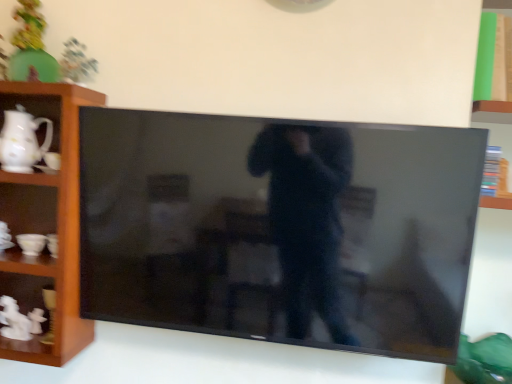
What do you see at coordinates (31, 47) in the screenshot? The width and height of the screenshot is (512, 384). I see `matte green toy at upper left` at bounding box center [31, 47].

What is the approximate width of black glossy tv at center?

black glossy tv at center is 6.54 inches in width.

This screenshot has height=384, width=512. Describe the element at coordinates (29, 179) in the screenshot. I see `white glossy pitcher at left` at that location.

This screenshot has height=384, width=512. I want to click on matte green toy at upper left, so (31, 47).

Which object is closer to the camera, white glossy pitcher at left or black glossy tv at center?

black glossy tv at center is more forward.

Considering the relative positions of white glossy pitcher at left and black glossy tv at center in the image provided, is white glossy pitcher at left to the left of black glossy tv at center from the viewer's perspective?

Correct, you'll find white glossy pitcher at left to the left of black glossy tv at center.

How different are the orientations of white glossy pitcher at left and black glossy tv at center in degrees?

white glossy pitcher at left and black glossy tv at center are facing 3.31 degrees away from each other.

From the image's perspective, is white glossy pitcher at left above or below black glossy tv at center?

Clearly, from the image's perspective, white glossy pitcher at left is above black glossy tv at center.

Can you confirm if white glossy pitcher at left is bigger than matte green toy at upper left?

Actually, white glossy pitcher at left might be smaller than matte green toy at upper left.

From the image's perspective, does white glossy pitcher at left appear lower than matte green toy at upper left?

Yes, from the image's perspective, white glossy pitcher at left is beneath matte green toy at upper left.

Locate an element on the screen. Image resolution: width=512 pixels, height=384 pixels. toy above the white glossy pitcher at left (from a real-world perspective) is located at coordinates (31, 47).

Considering the positions of objects matte green toy at upper left and white glossy pitcher at left in the image provided, who is more to the right, matte green toy at upper left or white glossy pitcher at left?

Positioned to the right is matte green toy at upper left.

You are a GUI agent. You are given a task and a screenshot of the screen. Output one action in this format:
    pyautogui.click(x=<x>, y=<y>)
    Task: Click on the cabinet located underneath the matte green toy at upper left (from a real-world perspective)
    
    Given the screenshot: What is the action you would take?
    pyautogui.click(x=29, y=179)

Is white glossy pitcher at left at the back of matte green toy at upper left?

No.

Are matte green toy at upper left and white glossy pitcher at left making contact?

No, matte green toy at upper left is not touching white glossy pitcher at left.

Considering the relative sizes of wooden shelf at left and black glossy tv at center in the image provided, is wooden shelf at left taller than black glossy tv at center?

Indeed, wooden shelf at left has a greater height compared to black glossy tv at center.

Is point (62, 257) farther from camera compared to point (324, 319)?

Yes, point (62, 257) is behind point (324, 319).

Is the surface of wooden shelf at left in direct contact with black glossy tv at center?

No.

From a real-world perspective, relative to black glossy tv at center, is wooden shelf at left vertically above or below?

From a real-world perspective, wooden shelf at left is physically below black glossy tv at center.

Does matte green toy at upper left turn towards black glossy tv at center?

No, matte green toy at upper left does not turn towards black glossy tv at center.

From a real-world perspective, between matte green toy at upper left and black glossy tv at center, who is vertically lower?

black glossy tv at center.

Are matte green toy at upper left and black glossy tv at center far apart?

No.

This screenshot has height=384, width=512. In order to click on shelf below the matte green toy at upper left (from a real-world perspective) in this screenshot , I will do `click(46, 223)`.

Is matte green toy at upper left closer to camera compared to wooden shelf at left?

No, matte green toy at upper left is behind wooden shelf at left.

How different are the orientations of matte green toy at upper left and wooden shelf at left in degrees?

They differ by 0.0844 degrees in their facing directions.

Is matte green toy at upper left positioned beyond the bounds of wooden shelf at left?

matte green toy at upper left lies outside wooden shelf at left's area.

Considering the sizes of objects black glossy tv at center and wooden shelf at left in the image provided, who is wider, black glossy tv at center or wooden shelf at left?

With larger width is wooden shelf at left.

Is black glossy tv at center far from wooden shelf at left?

No, black glossy tv at center is not far from wooden shelf at left.

How many degrees apart are the facing directions of black glossy tv at center and wooden shelf at left?

1.77 degrees.

Is black glossy tv at center facing towards wooden shelf at left?

→ No, black glossy tv at center is not oriented towards wooden shelf at left.

Where is `television below the white glossy pitcher at left (from the image's perspective)`? The height and width of the screenshot is (384, 512). television below the white glossy pitcher at left (from the image's perspective) is located at coordinates (280, 229).

This screenshot has width=512, height=384. Find the location of `cabinet directly beneath the matte green toy at upper left (from a real-world perspective)`. cabinet directly beneath the matte green toy at upper left (from a real-world perspective) is located at coordinates (29, 179).

Which object lies further to the anchor point white glossy pitcher at left, matte green toy at upper left or wooden shelf at left?

matte green toy at upper left is positioned further to the anchor white glossy pitcher at left.

Estimate the real-world distances between objects in this image. Which object is closer to wooden shelf at left, white glossy pitcher at left or black glossy tv at center?

white glossy pitcher at left is positioned closer to the anchor wooden shelf at left.

When comparing their distances from white glossy pitcher at left, does black glossy tv at center or wooden shelf at left seem closer?

Among the two, wooden shelf at left is located nearer to white glossy pitcher at left.

Considering their positions, is black glossy tv at center positioned closer to white glossy pitcher at left than matte green toy at upper left?

matte green toy at upper left.

Considering their positions, is matte green toy at upper left positioned further to wooden shelf at left than white glossy pitcher at left?

Among the two, matte green toy at upper left is located further to wooden shelf at left.

Considering their positions, is wooden shelf at left positioned further to white glossy pitcher at left than black glossy tv at center?

black glossy tv at center lies further to white glossy pitcher at left than the other object.

Considering their positions, is wooden shelf at left positioned closer to white glossy pitcher at left than matte green toy at upper left?

wooden shelf at left lies closer to white glossy pitcher at left than the other object.

When comparing their distances from black glossy tv at center, does wooden shelf at left or matte green toy at upper left seem further?

The object further to black glossy tv at center is matte green toy at upper left.

Locate an element on the screen. The width and height of the screenshot is (512, 384). shelf between white glossy pitcher at left and black glossy tv at center in the horizontal direction is located at coordinates (46, 223).

The height and width of the screenshot is (384, 512). I want to click on toy between white glossy pitcher at left and black glossy tv at center, so click(31, 47).

I want to click on toy situated between wooden shelf at left and black glossy tv at center from left to right, so click(x=31, y=47).

Find the location of `cabinet between matte green toy at upper left and wooden shelf at left from top to bottom`. cabinet between matte green toy at upper left and wooden shelf at left from top to bottom is located at coordinates (29, 179).